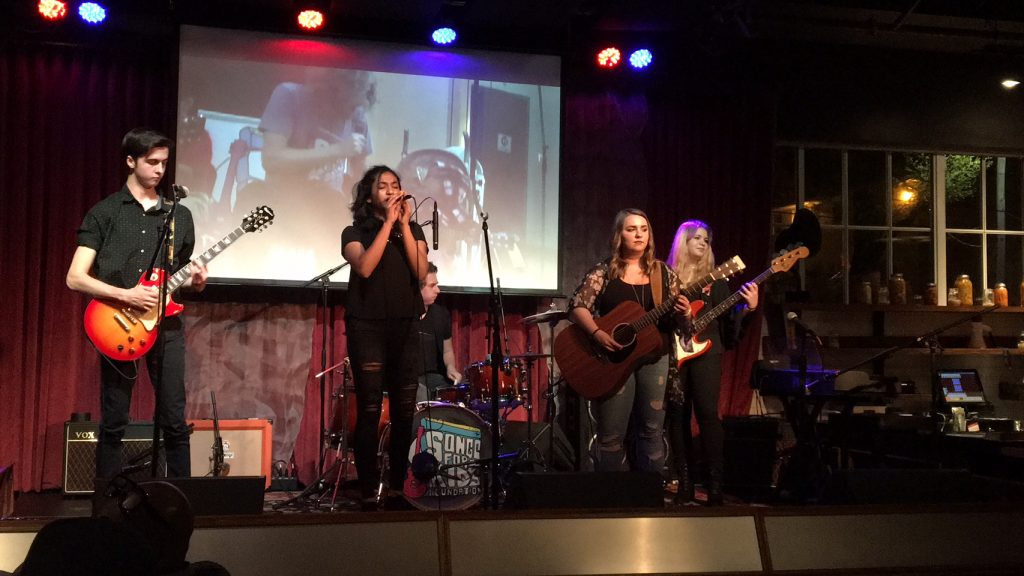
Identify the location of screen. The width and height of the screenshot is (1024, 576). (379, 130).